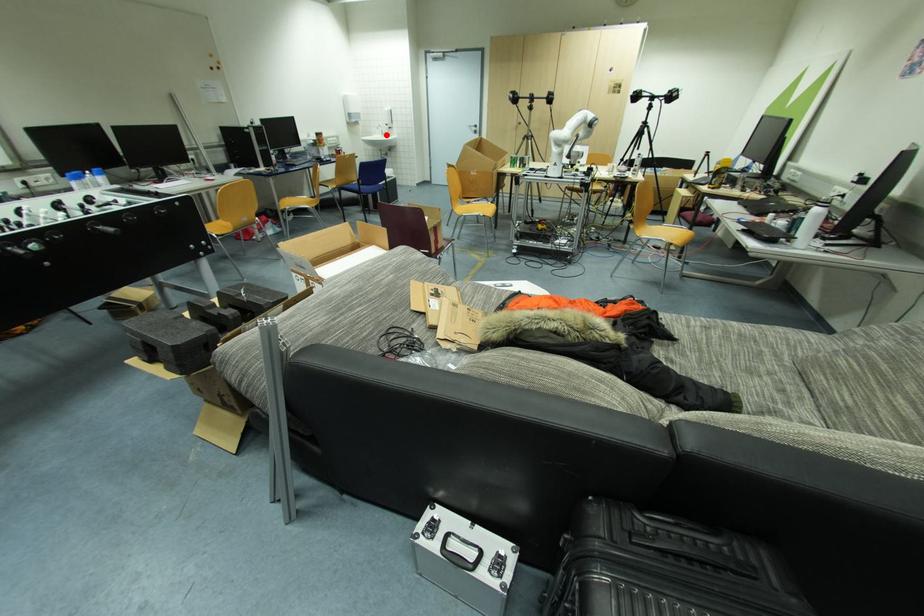
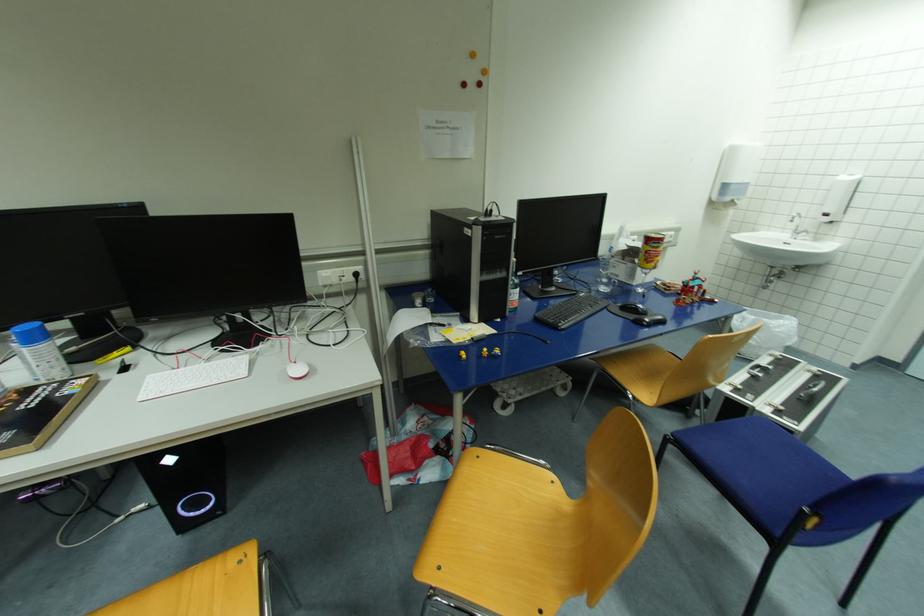
Where in the second image is the point corresponding to the highlighted location from the first image?

(799, 233)